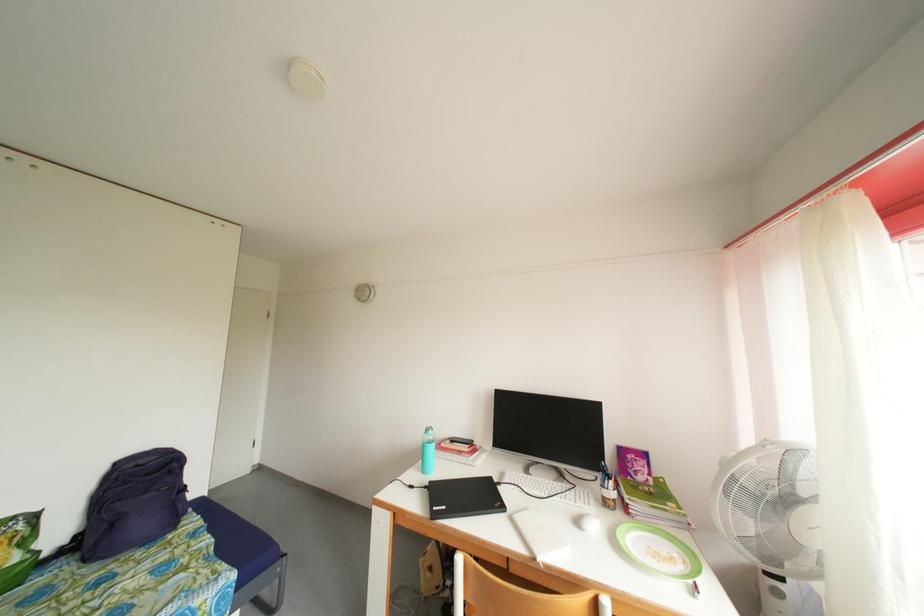
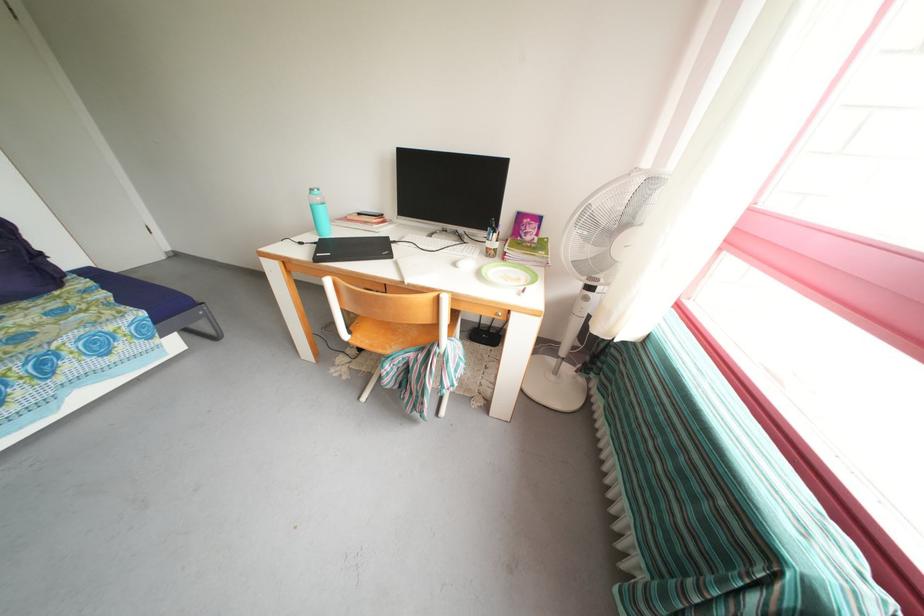
The point at (533, 476) is marked in the first image. Where is the corresponding point in the second image?

(436, 241)